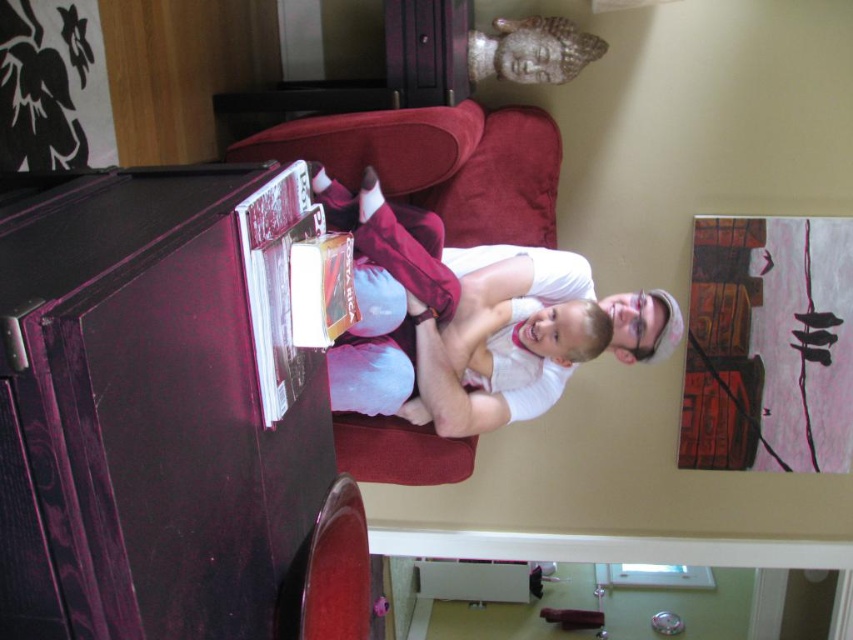
Is velvet red couch at center above hardcover book at center?

Indeed, velvet red couch at center is positioned over hardcover book at center.

Is velvet red couch at center to the left of hardcover book at center from the viewer's perspective?

In fact, velvet red couch at center is to the right of hardcover book at center.

Who is more distant from viewer, [550,170] or [314,280]?

The point [550,170] is behind.

Where is `velvet red couch at center`? velvet red couch at center is located at coordinates point(438,163).

Can you confirm if white cotton shirt at center is thinner than velvet red couch at center?

In fact, white cotton shirt at center might be wider than velvet red couch at center.

Between white cotton shirt at center and velvet red couch at center, which one has more height?

white cotton shirt at center is taller.

Find the location of `white cotton shirt at center`. white cotton shirt at center is located at coordinates (469, 321).

Find the location of a particular element. Image resolution: width=853 pixels, height=640 pixels. white cotton shirt at center is located at coordinates (469, 321).

Who is higher up, matte black dresser at left or white cotton shirt at center?

white cotton shirt at center

Does matte black dresser at left appear on the left side of white cotton shirt at center?

Yes, matte black dresser at left is to the left of white cotton shirt at center.

This screenshot has height=640, width=853. What are the coordinates of `matte black dresser at left` in the screenshot? It's located at (149, 410).